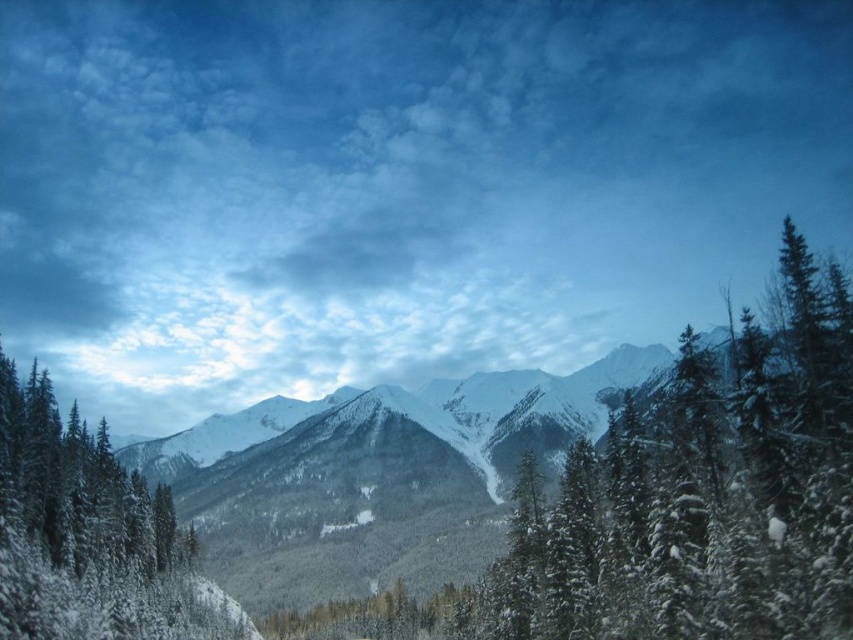
Question: Is snow-covered evergreen at center behind snow-covered evergreen at left?

Choices:
 (A) no
 (B) yes

Answer: (A)

Question: Can you confirm if snow-covered evergreen at center is positioned below snow-covered evergreen at left?

Choices:
 (A) no
 (B) yes

Answer: (A)

Question: Among these points, which one is farthest from the camera?

Choices:
 (A) (755, 616)
 (B) (38, 490)

Answer: (B)

Question: Does snow-covered evergreen at center have a larger size compared to snow-covered evergreen at left?

Choices:
 (A) yes
 (B) no

Answer: (A)